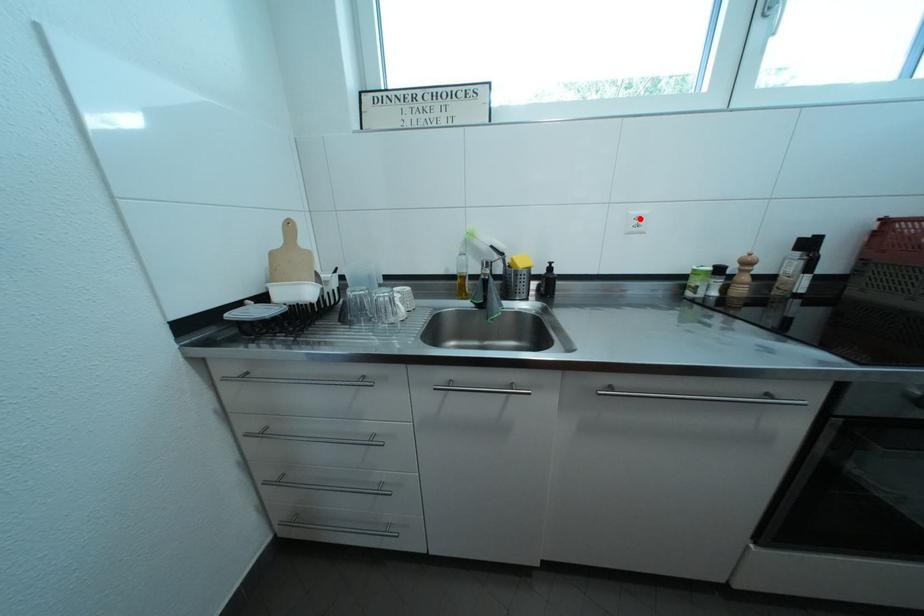
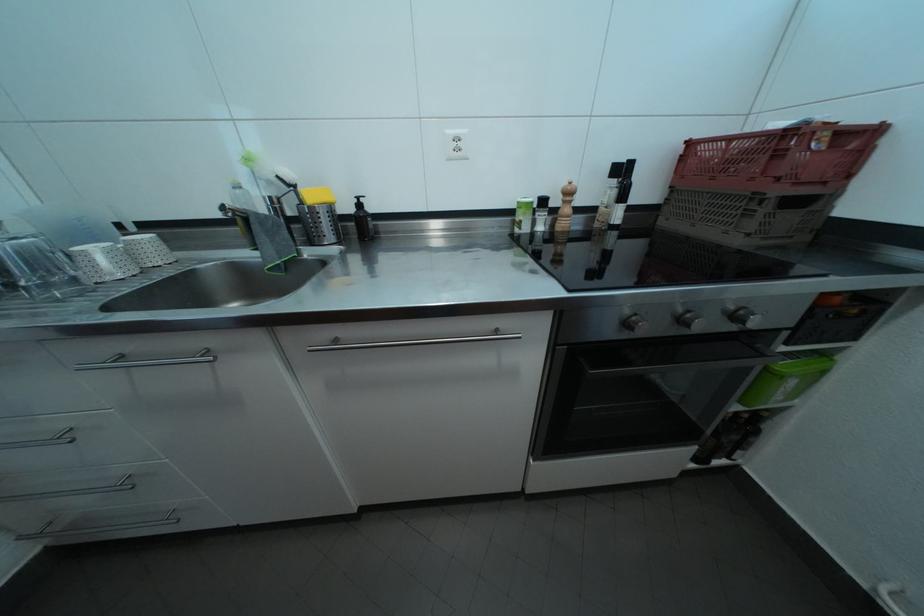
Find the pixel in the second image that matches the highlighted location in the first image.

(456, 138)